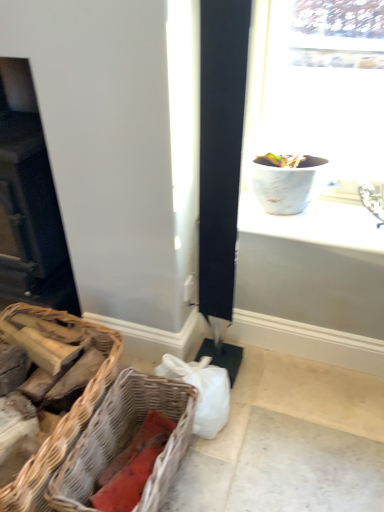
Question: Would you say white textured vase at upper right is inside or outside woven wood picnic basket at lower left, the 2th picnic basket in the left-to-right sequence?

Choices:
 (A) inside
 (B) outside

Answer: (B)

Question: Considering their positions, is white textured vase at upper right located in front of or behind woven wood picnic basket at lower left, the 2th picnic basket in the left-to-right sequence?

Choices:
 (A) behind
 (B) front

Answer: (A)

Question: Estimate the real-world distances between objects in this image. Which object is farther from the woven wood picnic basket at lower left, the 2th picnic basket in the left-to-right sequence?

Choices:
 (A) brown wicker picnic basket at lower left, the first picnic basket when ordered from left to right
 (B) matte black fireplace at left
 (C) white textured vase at upper right

Answer: (B)

Question: Considering the real-world distances, which object is closest to the woven wood picnic basket at lower left, the first picnic basket viewed from the right?

Choices:
 (A) matte black fireplace at left
 (B) brown wicker picnic basket at lower left, the 2th picnic basket when ordered from right to left
 (C) white textured vase at upper right

Answer: (B)